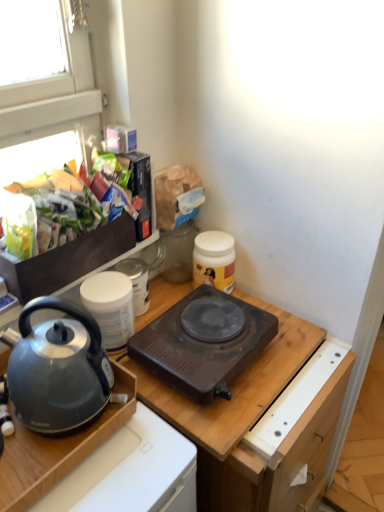
What are the coordinates of `shiny plastic bag of chips at upper left` in the screenshot? It's located at (72, 203).

You are a GUI agent. You are given a task and a screenshot of the screen. Output one action in this format:
    pyautogui.click(x=<x>, y=<y>)
    Task: Click on the dark brown plastic hot plate at center, positioned as the second kitchen appliance in right-to-left order
    The height and width of the screenshot is (512, 384).
    Given the screenshot: What is the action you would take?
    pyautogui.click(x=202, y=346)

I want to click on white matte container at upper left, arranged as the 3th kitchen appliance when viewed from the right, so click(x=110, y=307).

This screenshot has width=384, height=512. In order to click on wooden cutting board at center in this screenshot , I will do `click(254, 423)`.

Where is `shiny plastic bag of chips at upper left`? shiny plastic bag of chips at upper left is located at coordinates (72, 203).

Looking at this image, is white matte container at upper left, arranged as the 3th kitchen appliance when viewed from the right, taller or shorter than yellow matte jar at upper right, which appears as the 3th kitchen appliance when viewed from the left?

Considering their sizes, white matte container at upper left, arranged as the 3th kitchen appliance when viewed from the right, has less height than yellow matte jar at upper right, which appears as the 3th kitchen appliance when viewed from the left.

How much distance is there between white matte container at upper left, arranged as the first kitchen appliance when viewed from the left, and yellow matte jar at upper right, which ranks as the first kitchen appliance in right-to-left order?

A distance of 27.72 centimeters exists between white matte container at upper left, arranged as the first kitchen appliance when viewed from the left, and yellow matte jar at upper right, which ranks as the first kitchen appliance in right-to-left order.

Does white matte container at upper left, arranged as the first kitchen appliance when viewed from the left, touch yellow matte jar at upper right, which ranks as the first kitchen appliance in right-to-left order?

white matte container at upper left, arranged as the first kitchen appliance when viewed from the left, and yellow matte jar at upper right, which ranks as the first kitchen appliance in right-to-left order, are clearly separated.

From a real-world perspective, which is physically below, white matte container at upper left, arranged as the first kitchen appliance when viewed from the left, or yellow matte jar at upper right, which appears as the 3th kitchen appliance when viewed from the left?

yellow matte jar at upper right, which appears as the 3th kitchen appliance when viewed from the left, from a real-world perspective.

From the image's perspective, would you say yellow matte jar at upper right, which ranks as the first kitchen appliance in right-to-left order, is shown under shiny plastic bag of chips at upper left?

Indeed, from the image's perspective, yellow matte jar at upper right, which ranks as the first kitchen appliance in right-to-left order, is shown beneath shiny plastic bag of chips at upper left.

Is yellow matte jar at upper right, which ranks as the first kitchen appliance in right-to-left order, bigger or smaller than shiny plastic bag of chips at upper left?

In the image, yellow matte jar at upper right, which ranks as the first kitchen appliance in right-to-left order, appears to be smaller than shiny plastic bag of chips at upper left.

Is yellow matte jar at upper right, which ranks as the first kitchen appliance in right-to-left order, situated inside shiny plastic bag of chips at upper left or outside?

yellow matte jar at upper right, which ranks as the first kitchen appliance in right-to-left order, lies outside shiny plastic bag of chips at upper left.

Considering the positions of objects yellow matte jar at upper right, which appears as the 3th kitchen appliance when viewed from the left, and shiny plastic bag of chips at upper left in the image provided, who is behind, yellow matte jar at upper right, which appears as the 3th kitchen appliance when viewed from the left, or shiny plastic bag of chips at upper left?

yellow matte jar at upper right, which appears as the 3th kitchen appliance when viewed from the left, is further from the camera.

Between white matte jar at center and shiny plastic bag of chips at upper left, which one has less height?

With less height is white matte jar at center.

Would you say white matte jar at center is to the left or to the right of shiny plastic bag of chips at upper left in the picture?

white matte jar at center is positioned on shiny plastic bag of chips at upper left's right side.

Is white matte jar at center inside the boundaries of shiny plastic bag of chips at upper left, or outside?

white matte jar at center is located beyond the bounds of shiny plastic bag of chips at upper left.

Relative to white matte container at upper left, arranged as the 3th kitchen appliance when viewed from the right, is metallic gray kettle at left in front or behind?

Visually, metallic gray kettle at left is located in front of white matte container at upper left, arranged as the 3th kitchen appliance when viewed from the right.

Are metallic gray kettle at left and white matte container at upper left, arranged as the first kitchen appliance when viewed from the left, located far from each other?

No, there isn't a large distance between metallic gray kettle at left and white matte container at upper left, arranged as the first kitchen appliance when viewed from the left.

Can you confirm if metallic gray kettle at left is thinner than white matte container at upper left, arranged as the 3th kitchen appliance when viewed from the right?

No, metallic gray kettle at left is not thinner than white matte container at upper left, arranged as the 3th kitchen appliance when viewed from the right.

Considering the sizes of objects wooden cutting board at center and white matte container at upper left, arranged as the first kitchen appliance when viewed from the left, in the image provided, who is thinner, wooden cutting board at center or white matte container at upper left, arranged as the first kitchen appliance when viewed from the left,?

white matte container at upper left, arranged as the first kitchen appliance when viewed from the left.

Considering the relative sizes of wooden cutting board at center and white matte container at upper left, arranged as the first kitchen appliance when viewed from the left, in the image provided, is wooden cutting board at center shorter than white matte container at upper left, arranged as the first kitchen appliance when viewed from the left,?

In fact, wooden cutting board at center may be taller than white matte container at upper left, arranged as the first kitchen appliance when viewed from the left.

Between wooden cutting board at center and white matte container at upper left, arranged as the first kitchen appliance when viewed from the left, which one has smaller size?

With smaller size is white matte container at upper left, arranged as the first kitchen appliance when viewed from the left.

Is wooden cutting board at center positioned beyond the bounds of white matte container at upper left, arranged as the 3th kitchen appliance when viewed from the right?

wooden cutting board at center lies outside white matte container at upper left, arranged as the 3th kitchen appliance when viewed from the right,'s area.

Is dark brown plastic hot plate at center, arranged as the second kitchen appliance when viewed from the left, facing towards shiny plastic bag of chips at upper left?

No, dark brown plastic hot plate at center, arranged as the second kitchen appliance when viewed from the left, is not aimed at shiny plastic bag of chips at upper left.

From a real-world perspective, is dark brown plastic hot plate at center, arranged as the second kitchen appliance when viewed from the left, below shiny plastic bag of chips at upper left?

Yes.

From the image's perspective, which is below, dark brown plastic hot plate at center, positioned as the second kitchen appliance in right-to-left order, or shiny plastic bag of chips at upper left?

dark brown plastic hot plate at center, positioned as the second kitchen appliance in right-to-left order.

Locate an element on the screen. the 3rd kitchen appliance positioned below the shiny plastic bag of chips at upper left (from the image's perspective) is located at coordinates (202, 346).

Considering the positions of objects white matte container at upper left, arranged as the first kitchen appliance when viewed from the left, and metallic gray kettle at left in the image provided, who is more to the right, white matte container at upper left, arranged as the first kitchen appliance when viewed from the left, or metallic gray kettle at left?

white matte container at upper left, arranged as the first kitchen appliance when viewed from the left.

Considering the sizes of white matte container at upper left, arranged as the 3th kitchen appliance when viewed from the right, and metallic gray kettle at left in the image, is white matte container at upper left, arranged as the 3th kitchen appliance when viewed from the right, bigger or smaller than metallic gray kettle at left?

white matte container at upper left, arranged as the 3th kitchen appliance when viewed from the right, is smaller than metallic gray kettle at left.

Does white matte container at upper left, arranged as the first kitchen appliance when viewed from the left, have a greater width compared to metallic gray kettle at left?

No.

From the image's perspective, is white matte container at upper left, arranged as the first kitchen appliance when viewed from the left, positioned above or below metallic gray kettle at left?

white matte container at upper left, arranged as the first kitchen appliance when viewed from the left, is above metallic gray kettle at left.

Starting from the white matte container at upper left, arranged as the first kitchen appliance when viewed from the left, which kitchen appliance is the 2nd one to the right? Please provide its 2D coordinates.

[(214, 260)]

From the image's perspective, which kitchen appliance is the 1st one below the shiny plastic bag of chips at upper left? Please provide its 2D coordinates.

[(214, 260)]

Based on their spatial positions, is yellow matte jar at upper right, which ranks as the first kitchen appliance in right-to-left order, or white matte container at upper left, arranged as the first kitchen appliance when viewed from the left, closer to metallic gray kettle at left?

white matte container at upper left, arranged as the first kitchen appliance when viewed from the left.

Considering their positions, is dark brown plastic hot plate at center, arranged as the second kitchen appliance when viewed from the left, positioned closer to white matte jar at center than yellow matte jar at upper right, which ranks as the first kitchen appliance in right-to-left order?

yellow matte jar at upper right, which ranks as the first kitchen appliance in right-to-left order.

Estimate the real-world distances between objects in this image. Which object is closer to shiny plastic bag of chips at upper left, white matte container at upper left, arranged as the 3th kitchen appliance when viewed from the right, or metallic gray kettle at left?

white matte container at upper left, arranged as the 3th kitchen appliance when viewed from the right.

Considering their positions, is white matte jar at center positioned further to wooden cutting board at center than yellow matte jar at upper right, which ranks as the first kitchen appliance in right-to-left order?

white matte jar at center is positioned further to the anchor wooden cutting board at center.

Considering their positions, is white matte container at upper left, arranged as the 3th kitchen appliance when viewed from the right, positioned closer to wooden cutting board at center than metallic gray kettle at left?

metallic gray kettle at left lies closer to wooden cutting board at center than the other object.

Estimate the real-world distances between objects in this image. Which object is closer to metallic gray kettle at left, yellow matte jar at upper right, which ranks as the first kitchen appliance in right-to-left order, or shiny plastic bag of chips at upper left?

Based on the image, shiny plastic bag of chips at upper left appears to be nearer to metallic gray kettle at left.

Based on their spatial positions, is white matte container at upper left, arranged as the 3th kitchen appliance when viewed from the right, or matte gray kettle at left further from metallic gray kettle at left?

Among the two, white matte container at upper left, arranged as the 3th kitchen appliance when viewed from the right, is located further to metallic gray kettle at left.

Looking at the image, which one is located further to white matte container at upper left, arranged as the 3th kitchen appliance when viewed from the right, wooden cutting board at center or shiny plastic bag of chips at upper left?

wooden cutting board at center.

Where is `desk located between matte gray kettle at left and yellow matte jar at upper right, which appears as the 3th kitchen appliance when viewed from the left, in the depth direction`? Image resolution: width=384 pixels, height=512 pixels. desk located between matte gray kettle at left and yellow matte jar at upper right, which appears as the 3th kitchen appliance when viewed from the left, in the depth direction is located at coordinates (57, 449).

The width and height of the screenshot is (384, 512). I want to click on kitchen appliance between matte gray kettle at left and white matte container at upper left, arranged as the 3th kitchen appliance when viewed from the right, from front to back, so click(202, 346).

I want to click on food located between metallic gray kettle at left and white matte jar at center in the depth direction, so click(x=72, y=203).

Image resolution: width=384 pixels, height=512 pixels. Find the location of `cabinetry located between metallic gray kettle at left and white matte jar at center in the depth direction`. cabinetry located between metallic gray kettle at left and white matte jar at center in the depth direction is located at coordinates (254, 423).